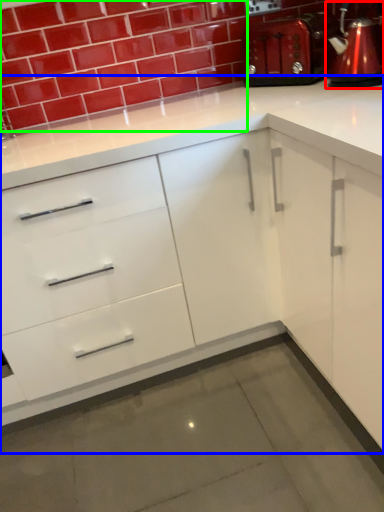
Question: Which object is the farthest from coffeepot (highlighted by a red box)? Choose among these: cabinetry (highlighted by a blue box) or brick (highlighted by a green box).

Choices:
 (A) cabinetry
 (B) brick

Answer: (B)